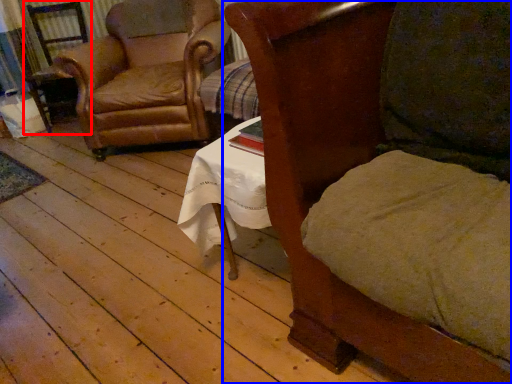
Question: Which of the following is the closest to the observer, armchair (highlighted by a red box) or chair (highlighted by a blue box)?

Choices:
 (A) armchair
 (B) chair

Answer: (B)